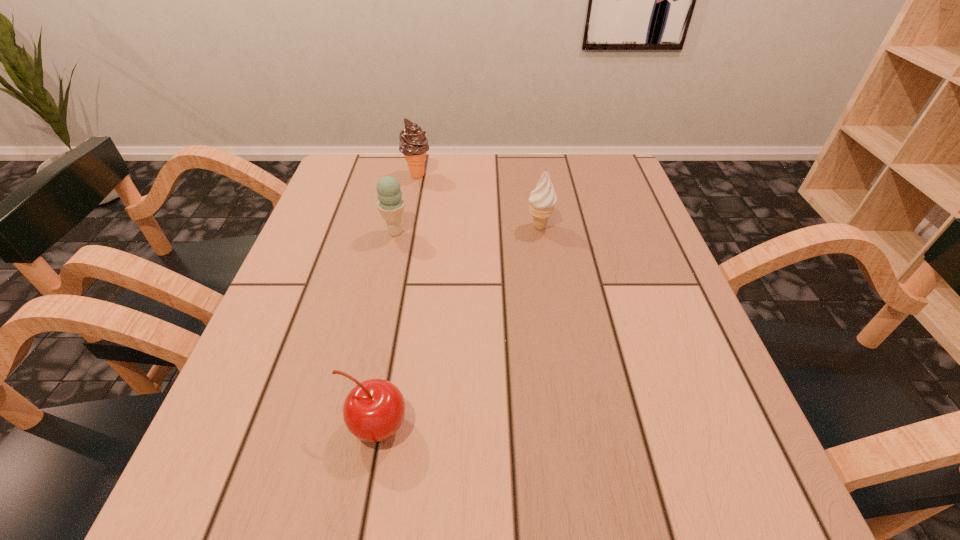
Choose which object is the third nearest neighbor to the farthest object. Please provide its 2D coordinates. Your answer should be formatted as a tuple, i.e. [(x, y)], where the tuple contains the x and y coordinates of a point satisfying the conditions above.

[(374, 409)]

Identify which object is the third closest to the farthest ice cream. Please provide its 2D coordinates. Your answer should be formatted as a tuple, i.e. [(x, y)], where the tuple contains the x and y coordinates of a point satisfying the conditions above.

[(374, 409)]

At what (x,y) coordinates should I click in order to perform the action: click on the second closest ice cream to the farthest object. Please return your answer as a coordinate pair (x, y). The height and width of the screenshot is (540, 960). Looking at the image, I should click on (542, 200).

In order to click on ice cream that is the second closest one to the farthest object in this screenshot , I will do `click(542, 200)`.

Find the location of a particular element. vacant region that satisfies the following two spatial constraints: 1. on the front-facing side of the rightmost object; 2. on the front side of the nearest object is located at coordinates (571, 426).